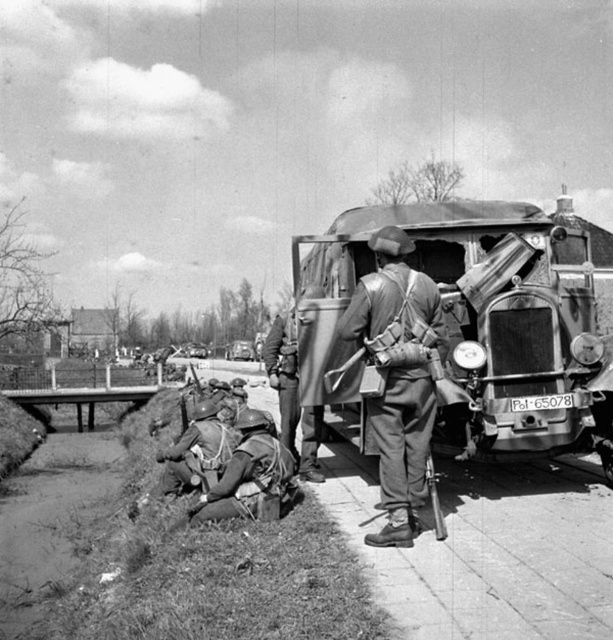
Question: Based on their relative distances, which object is farther from the metallic car at center?

Choices:
 (A) smooth leather jacket at center
 (B) leather jacket at center

Answer: (B)

Question: Does smooth leather jacket at center appear on the right side of camouflage fabric helmet at lower left?

Choices:
 (A) no
 (B) yes

Answer: (B)

Question: Does camouflage fabric soldier at lower left have a larger size compared to smooth leather jacket at center?

Choices:
 (A) no
 (B) yes

Answer: (A)

Question: Which of the following is the closest to the observer?

Choices:
 (A) (440, 333)
 (B) (237, 358)
 (C) (253, 509)

Answer: (A)

Question: Considering the real-world distances, which object is closest to the metallic car at center?

Choices:
 (A) camouflage fabric helmet at lower left
 (B) leather jacket at center
 (C) smooth leather jacket at center
 (D) camouflage fabric soldier at lower left

Answer: (C)

Question: Can you confirm if camouflage fabric soldier at lower left is positioned above smooth leather jacket at center?

Choices:
 (A) no
 (B) yes

Answer: (A)